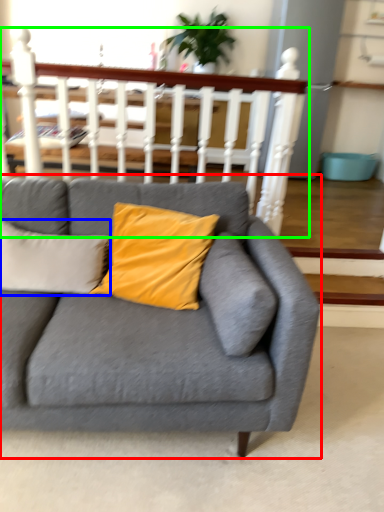
Question: Which object is the farthest from studio couch (highlighted by a red box)? Choose among these: pillow (highlighted by a blue box) or balustrade (highlighted by a green box).

Choices:
 (A) pillow
 (B) balustrade

Answer: (B)